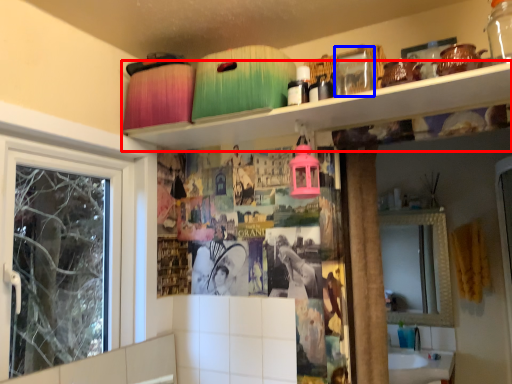
Question: Among these objects, which one is nearest to the camera, shelf (highlighted by a red box) or glass jar (highlighted by a blue box)?

Choices:
 (A) shelf
 (B) glass jar

Answer: (A)